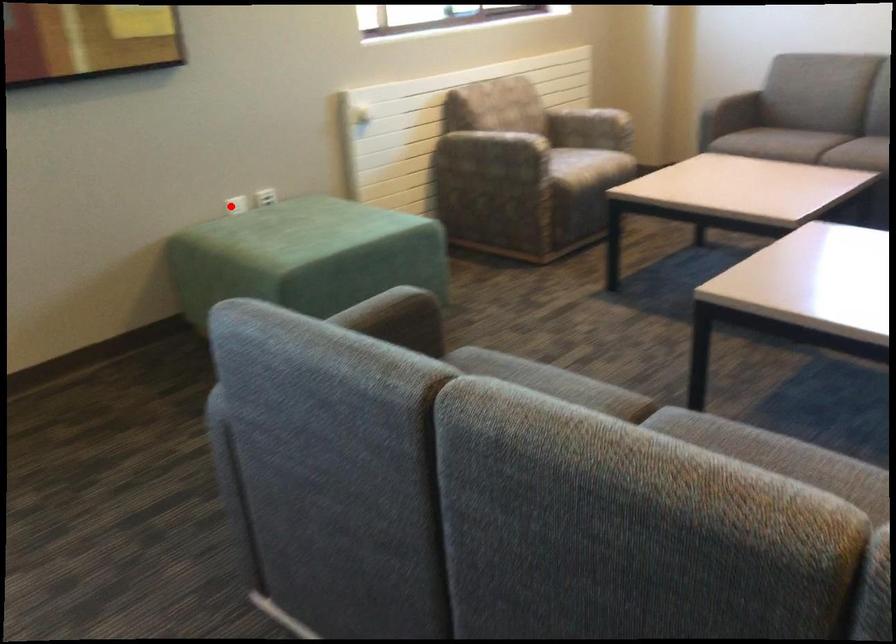
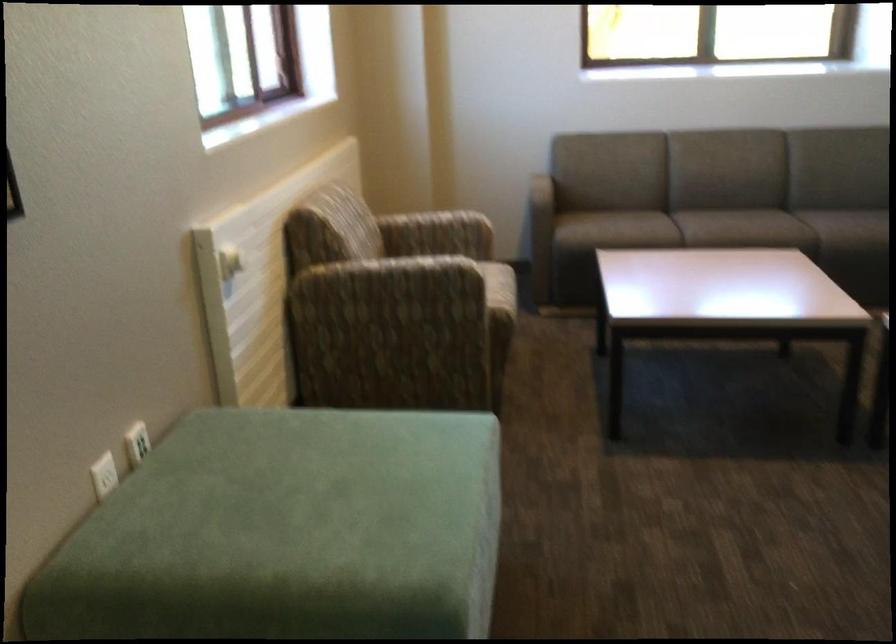
The point at the highlighted location is marked in the first image. Where is the corresponding point in the second image?

(104, 475)